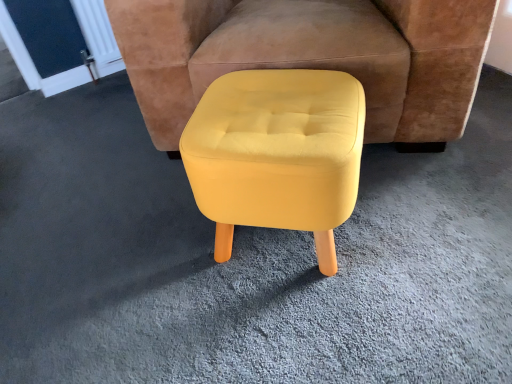
Image resolution: width=512 pixels, height=384 pixels. In order to click on vacant space in front of yellow fabric stool at center in this screenshot , I will do `click(337, 336)`.